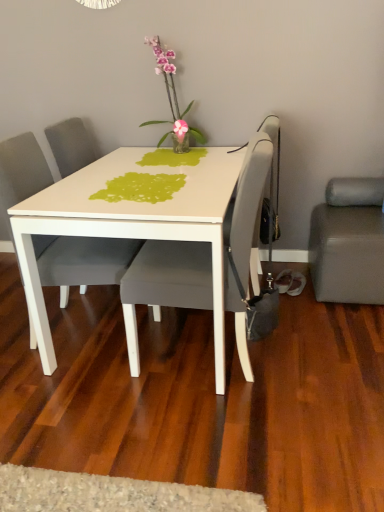
Question: Is suede gray studio couch at lower right positioned beyond the bounds of matte gray chair at center, which appears as the 2th chair when viewed from the right?

Choices:
 (A) yes
 (B) no

Answer: (A)

Question: Is suede gray studio couch at lower right positioned with its back to matte gray chair at center, the first chair viewed from the left?

Choices:
 (A) no
 (B) yes

Answer: (A)

Question: Are suede gray studio couch at lower right and matte gray chair at center, the first chair viewed from the left, beside each other?

Choices:
 (A) no
 (B) yes

Answer: (A)

Question: Does suede gray studio couch at lower right have a greater height compared to matte gray chair at center, the first chair viewed from the left?

Choices:
 (A) no
 (B) yes

Answer: (A)

Question: Is suede gray studio couch at lower right smaller than matte gray chair at center, which appears as the 2th chair when viewed from the right?

Choices:
 (A) no
 (B) yes

Answer: (B)

Question: Does suede gray studio couch at lower right lie in front of matte gray chair at center, the first chair viewed from the left?

Choices:
 (A) no
 (B) yes

Answer: (A)

Question: Considering the relative positions of translucent glass vase at upper center and matte gray chair at center, which is counted as the first chair, starting from the right, in the image provided, is translucent glass vase at upper center to the left of matte gray chair at center, which is counted as the first chair, starting from the right, from the viewer's perspective?

Choices:
 (A) yes
 (B) no

Answer: (A)

Question: Is translucent glass vase at upper center positioned behind matte gray chair at center, which is counted as the first chair, starting from the right?

Choices:
 (A) no
 (B) yes

Answer: (B)

Question: Could you tell me if translucent glass vase at upper center is turned towards matte gray chair at center, which is counted as the first chair, starting from the right?

Choices:
 (A) yes
 (B) no

Answer: (A)

Question: Is translucent glass vase at upper center smaller than matte gray chair at center, which is counted as the first chair, starting from the right?

Choices:
 (A) yes
 (B) no

Answer: (A)

Question: Is matte gray chair at center, the 2th chair in the left-to-right sequence, surrounded by translucent glass vase at upper center?

Choices:
 (A) no
 (B) yes

Answer: (A)

Question: Is translucent glass vase at upper center next to matte gray chair at center, which is counted as the first chair, starting from the right?

Choices:
 (A) no
 (B) yes

Answer: (A)

Question: Does suede gray studio couch at lower right touch translucent glass vase at upper center?

Choices:
 (A) yes
 (B) no

Answer: (B)